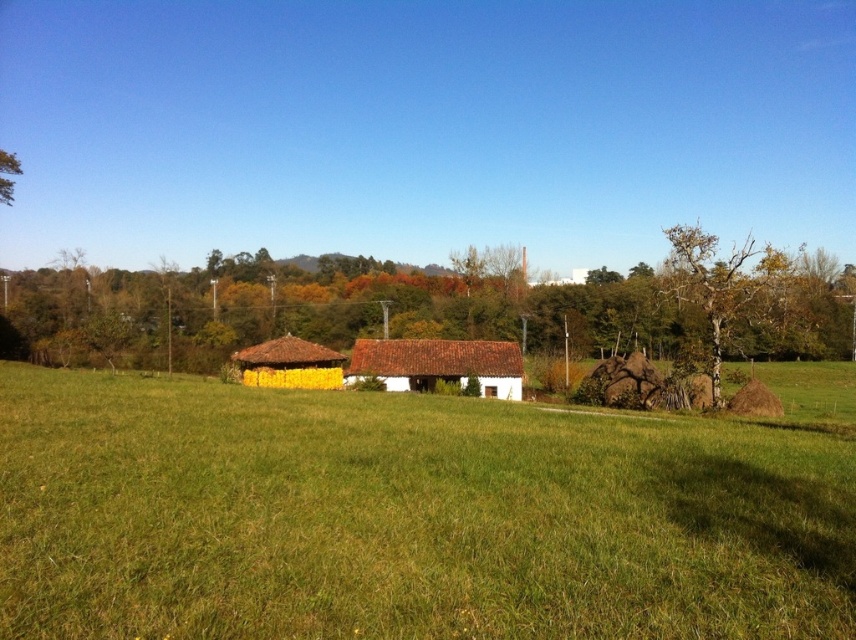
Question: Does yellow straw hut at center appear on the right side of green leafy tree at upper left?

Choices:
 (A) no
 (B) yes

Answer: (B)

Question: Which of the following is the closest to the observer?

Choices:
 (A) green grass at center
 (B) green leafy tree at upper left
 (C) yellow straw hut at center
 (D) brown textured tree at right

Answer: (A)

Question: Which object appears closest to the camera in this image?

Choices:
 (A) green grass at center
 (B) brown textured tree at right
 (C) white clay hut at center

Answer: (A)

Question: Is green grass at center positioned behind white clay hut at center?

Choices:
 (A) no
 (B) yes

Answer: (A)

Question: Which object is positioned closest to the green leafy tree at upper left?

Choices:
 (A) brown textured tree at right
 (B) white clay hut at center
 (C) yellow straw hut at center

Answer: (C)

Question: Is green grass at center further to the viewer compared to yellow straw hut at center?

Choices:
 (A) no
 (B) yes

Answer: (A)